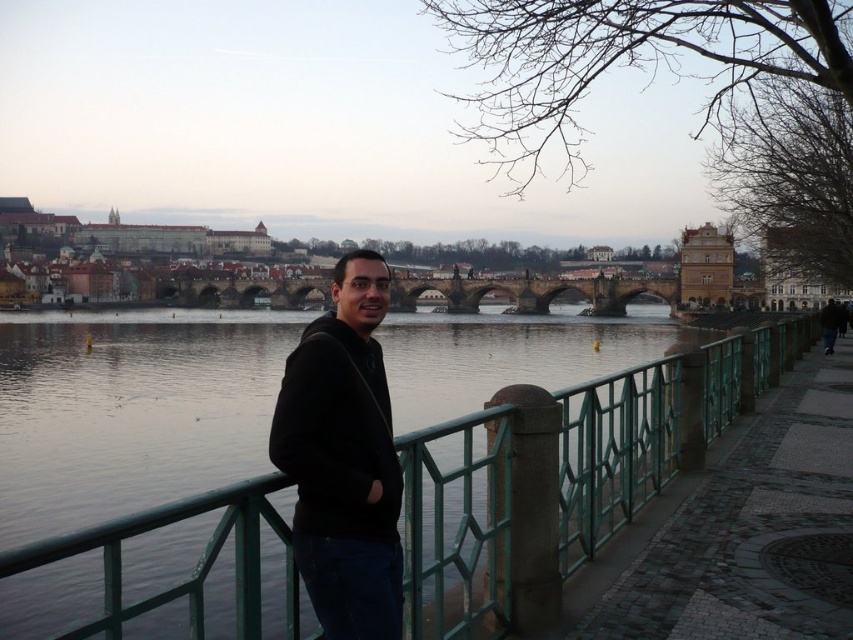
Is point (379, 352) closer to camera compared to point (831, 314)?

Yes, it is.

Does black matte hoodie at center have a smaller size compared to brown leather jacket at lower right?

Indeed, black matte hoodie at center has a smaller size compared to brown leather jacket at lower right.

Between point (376, 301) and point (827, 323), which one is positioned behind?

Point (827, 323)

Identify the location of black matte hoodie at center. The height and width of the screenshot is (640, 853). (343, 458).

Is green metallic water at center smaller than stone arch bridge at center?

No, green metallic water at center is not smaller than stone arch bridge at center.

Describe the element at coordinates (129, 410) in the screenshot. I see `green metallic water at center` at that location.

Between point (33, 536) and point (286, 292), which one is positioned in front?

Point (33, 536) is more forward.

The height and width of the screenshot is (640, 853). In order to click on green metallic water at center in this screenshot , I will do `click(129, 410)`.

Is black matte hoodie at center to the left of stone arch bridge at center from the viewer's perspective?

In fact, black matte hoodie at center is to the right of stone arch bridge at center.

Is black matte hoodie at center bigger than stone arch bridge at center?

No, black matte hoodie at center is not bigger than stone arch bridge at center.

Who is more forward, [358,262] or [201,300]?

Point [358,262] is in front.

Where is `black matte hoodie at center`? The height and width of the screenshot is (640, 853). black matte hoodie at center is located at coordinates (343, 458).